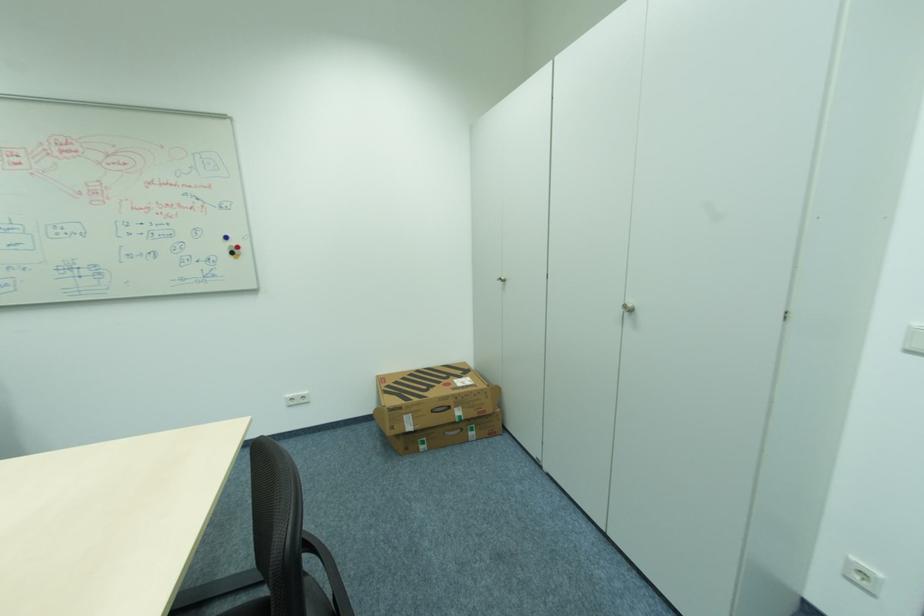
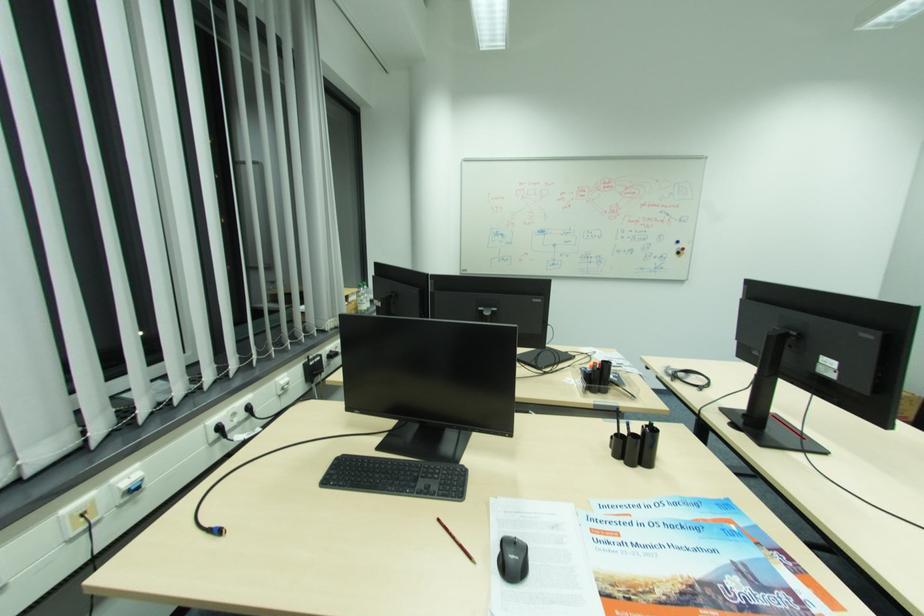
In the second image, find the point that corresponds to point 237,254 in the first image.

(684, 253)